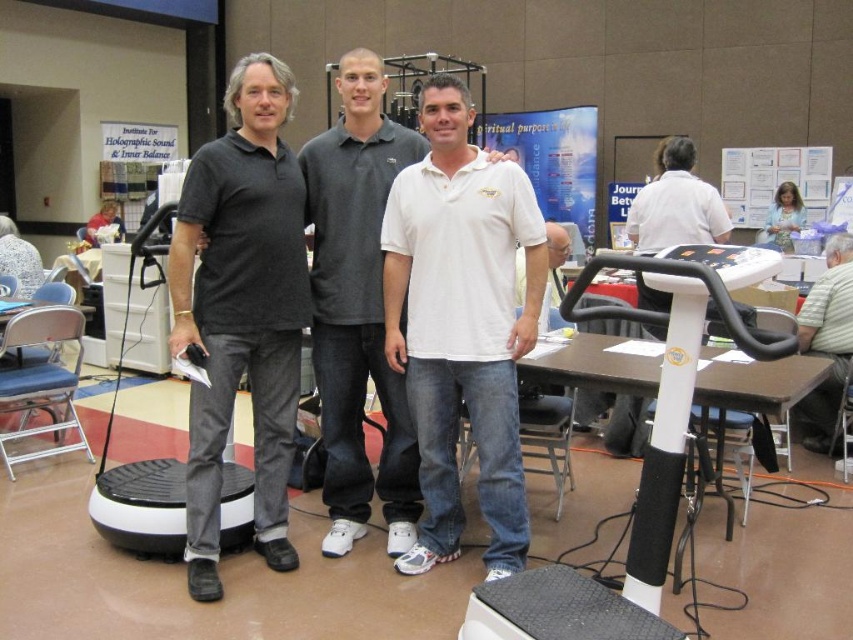
Question: Does gray striped shirt at lower right have a greater width compared to blue fabric shirt at center?

Choices:
 (A) no
 (B) yes

Answer: (B)

Question: Which object is the closest to the white cotton polo shirt at center?

Choices:
 (A) blue fabric shirt at center
 (B) black matte polo shirt at left
 (C) gray striped shirt at lower right

Answer: (B)

Question: Which point appears farthest from the camera in this image?

Choices:
 (A) (636, 202)
 (B) (801, 403)
 (C) (480, 186)
 (D) (776, 211)

Answer: (D)

Question: Is black matte polo shirt at left positioned at the back of gray striped shirt at lower right?

Choices:
 (A) yes
 (B) no

Answer: (B)

Question: Which of these objects is positioned closest to the white matte shirt at center?

Choices:
 (A) blue fabric shirt at center
 (B) black matte polo shirt at left

Answer: (B)

Question: From the image, what is the correct spatial relationship of white plastic exercise machine at right in relation to gray striped shirt at lower right?

Choices:
 (A) above
 (B) below

Answer: (A)